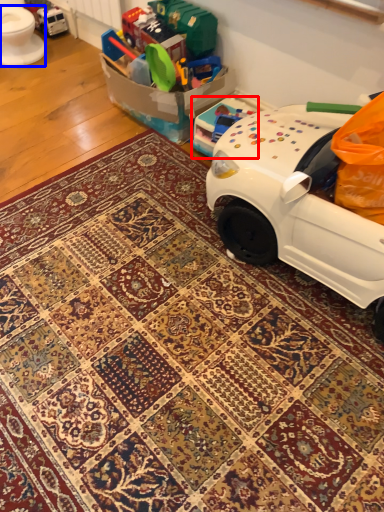
Question: Which object appears farthest to the camera in this image, toy (highlighted by a red box) or toilet bowl (highlighted by a blue box)?

Choices:
 (A) toy
 (B) toilet bowl

Answer: (B)